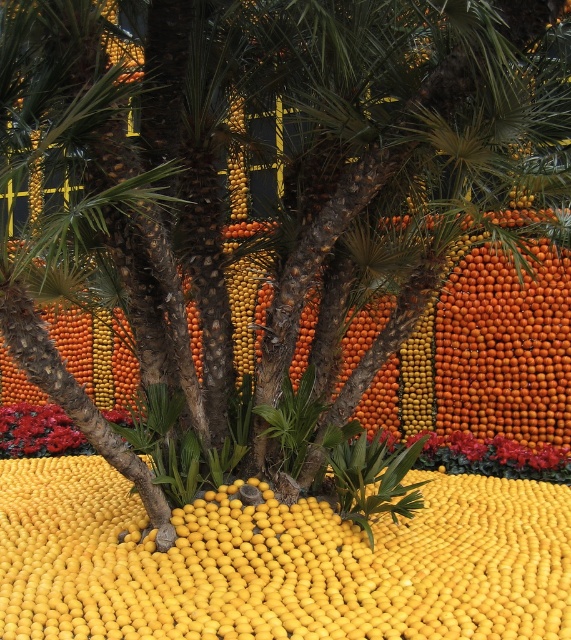
Question: Which point is closer to the camera?

Choices:
 (A) yellow matte lemon at center
 (B) shiny red petals at lower left

Answer: (A)

Question: Does yellow matte lemon at center appear on the left side of shiny red petals at lower left?

Choices:
 (A) no
 (B) yes

Answer: (A)

Question: Does yellow matte lemon at center have a lesser width compared to shiny red petals at lower left?

Choices:
 (A) yes
 (B) no

Answer: (B)

Question: Is yellow matte lemon at center smaller than shiny red petals at lower left?

Choices:
 (A) yes
 (B) no

Answer: (B)